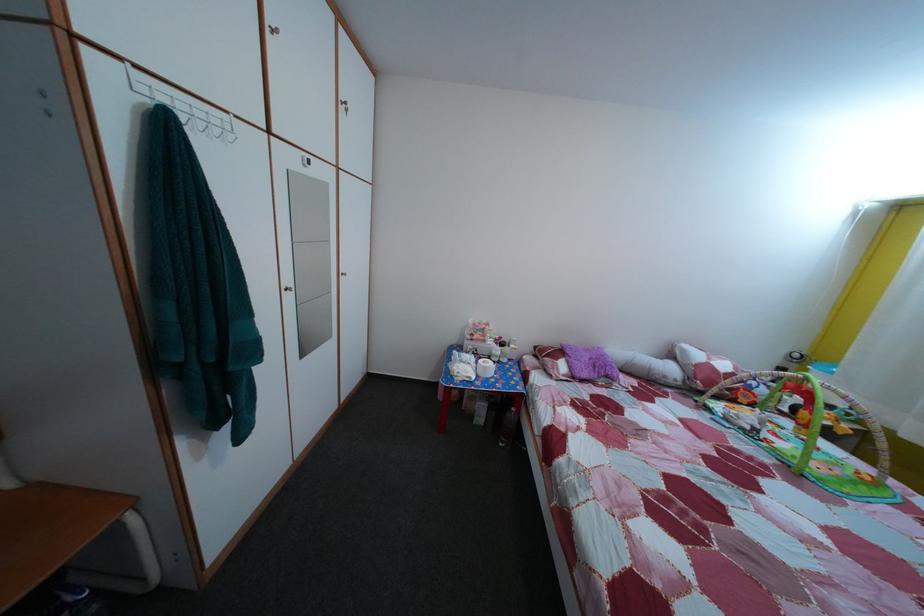
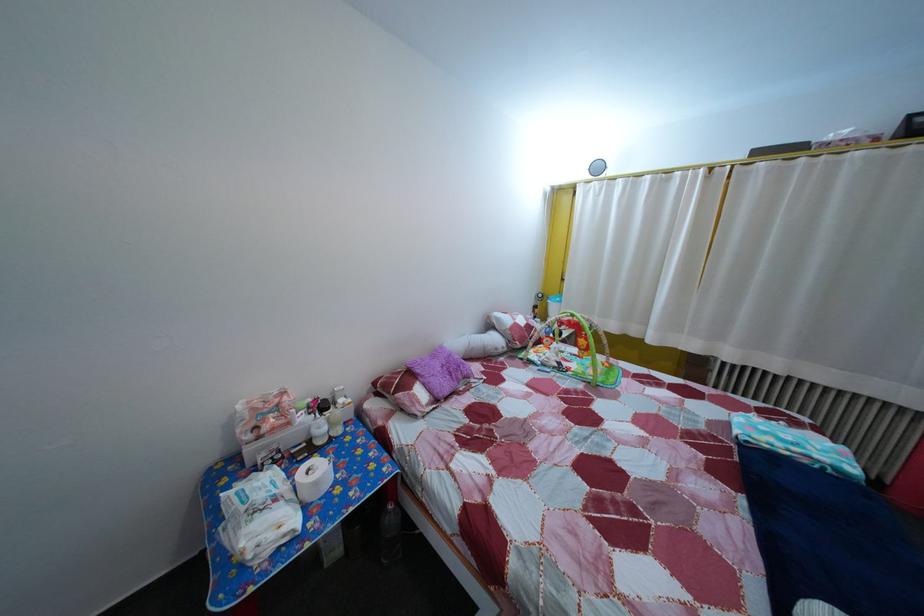
The point at (679, 378) is marked in the first image. Where is the corresponding point in the second image?

(505, 347)